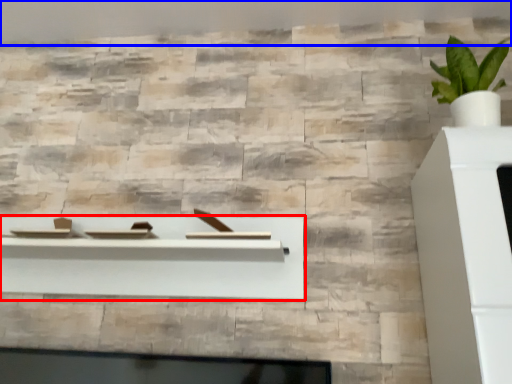
Question: Among these objects, which one is farthest to the camera, shelf (highlighted by a red box) or backdrop (highlighted by a blue box)?

Choices:
 (A) shelf
 (B) backdrop

Answer: (B)